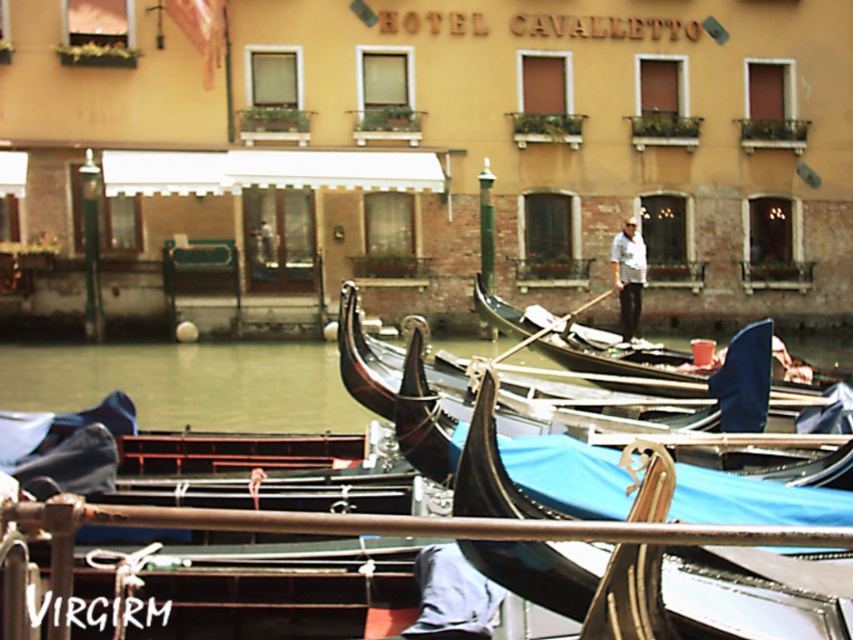
You are standing at the point with coordinates (784, 467) in the canal scene. What object are you directly above?

The point at coordinates (784, 467) is directly above the wooden gondola at center.

You are standing at the point with coordinates (624, 364) in the canal scene. Which object is exactly at your current position?

The black polished gondola at center is located at point (624, 364), so that is the object exactly at your current position.

You are a tourist planning to rent a gondola for a short trip. You see the wooden gondola at center and the black polished gondola at center. Which one can carry more passengers?

The wooden gondola at center is larger in size than the black polished gondola at center, so it can carry more passengers.